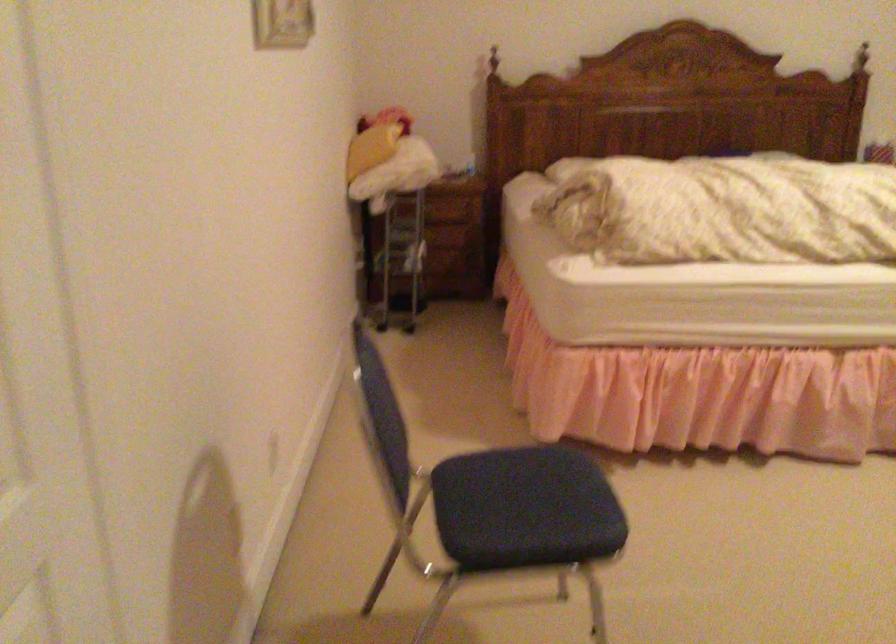
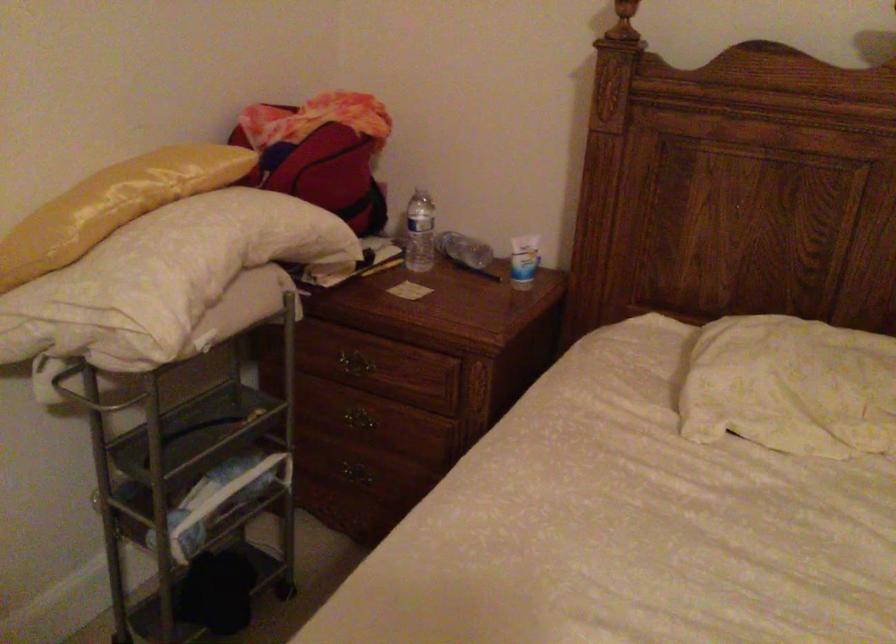
The point at (419, 236) is marked in the first image. Where is the corresponding point in the second image?

(357, 426)